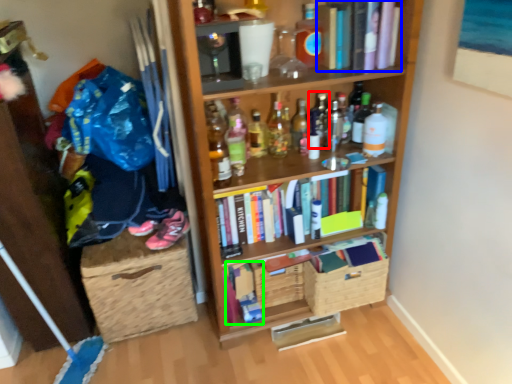
Question: Estimate the real-world distances between objects in this image. Which object is closer to bottle (highlighted by a red box), book (highlighted by a blue box) or book (highlighted by a green box)?

Choices:
 (A) book
 (B) book

Answer: (A)